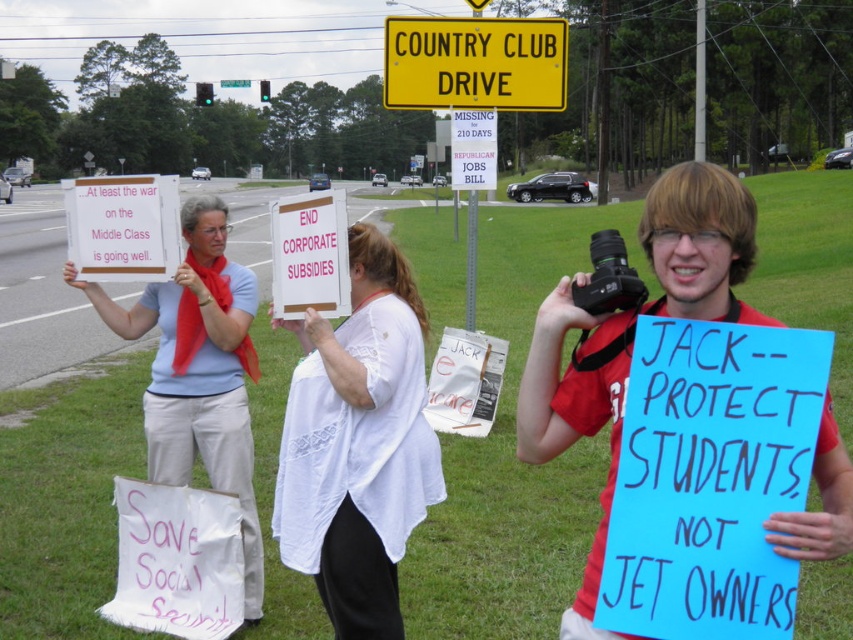
Can you confirm if white lace shirt at center is smaller than yellow plastic sign at upper center?

Yes, white lace shirt at center is smaller than yellow plastic sign at upper center.

Which of these two, white lace shirt at center or yellow plastic sign at upper center, stands taller?

white lace shirt at center

Between point (364, 321) and point (558, 58), which one is positioned behind?

Point (558, 58)

What are the coordinates of `white lace shirt at center` in the screenshot? It's located at (358, 444).

Which is more to the left, white lace shirt at center or pink paper sign at center?

Positioned to the left is pink paper sign at center.

The image size is (853, 640). What do you see at coordinates (358, 444) in the screenshot?
I see `white lace shirt at center` at bounding box center [358, 444].

This screenshot has height=640, width=853. Describe the element at coordinates (358, 444) in the screenshot. I see `white lace shirt at center` at that location.

Where is `white lace shirt at center`? The height and width of the screenshot is (640, 853). white lace shirt at center is located at coordinates [x=358, y=444].

Does yellow plastic sign at upper center have a lesser height compared to pink paper sign at center?

Incorrect, yellow plastic sign at upper center's height does not fall short of pink paper sign at center's.

This screenshot has height=640, width=853. Identify the location of yellow plastic sign at upper center. (474, 64).

Is point (556, 93) positioned behind point (291, 230)?

Yes.

The width and height of the screenshot is (853, 640). Find the location of `yellow plastic sign at upper center`. yellow plastic sign at upper center is located at coordinates (474, 64).